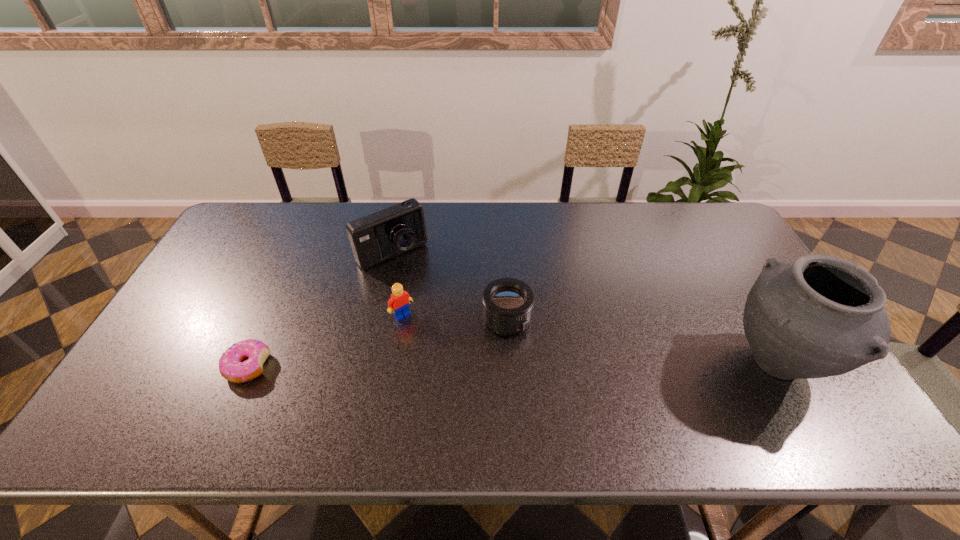
Find the location of a particular element. This screenshot has height=540, width=960. object at the far edge is located at coordinates (382, 235).

Identify the location of doughnut at the near edge. coord(232,367).

Find the location of a particular element. This screenshot has width=960, height=540. urn positioned at the near edge is located at coordinates 820,316.

Find the location of a particular element. The image size is (960, 540). object located in the right edge section of the desktop is located at coordinates (820, 316).

Identify the location of object that is at the near right corner. (820, 316).

Where is `vacant space at the far edge of the desktop`? This screenshot has height=540, width=960. vacant space at the far edge of the desktop is located at coordinates (514, 235).

Locate an element on the screen. vacant space at the near edge of the desktop is located at coordinates (593, 395).

I want to click on free spot at the right edge of the desktop, so click(742, 310).

Locate an element on the screen. free space at the far left corner is located at coordinates (252, 228).

Locate an element on the screen. The height and width of the screenshot is (540, 960). free region at the near left corner is located at coordinates (160, 372).